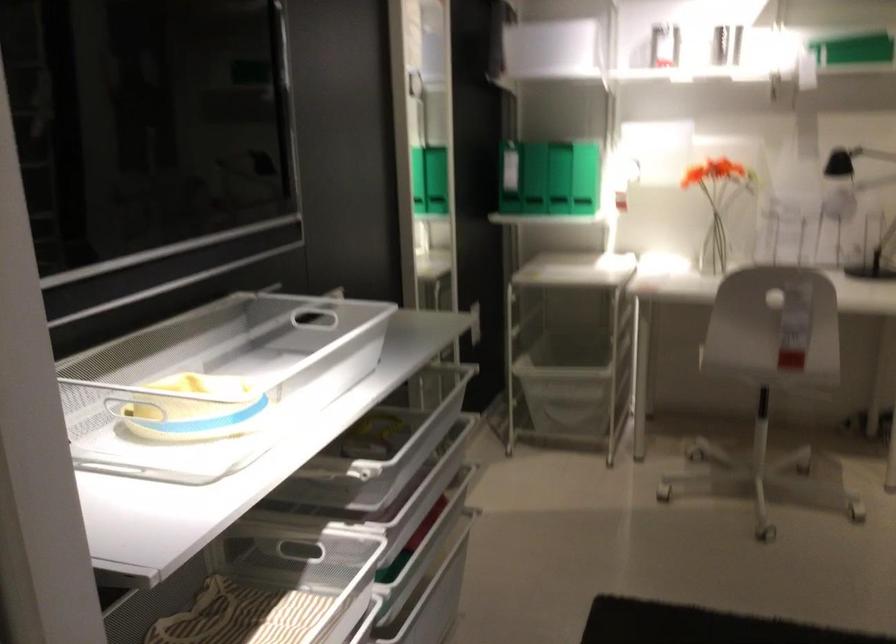
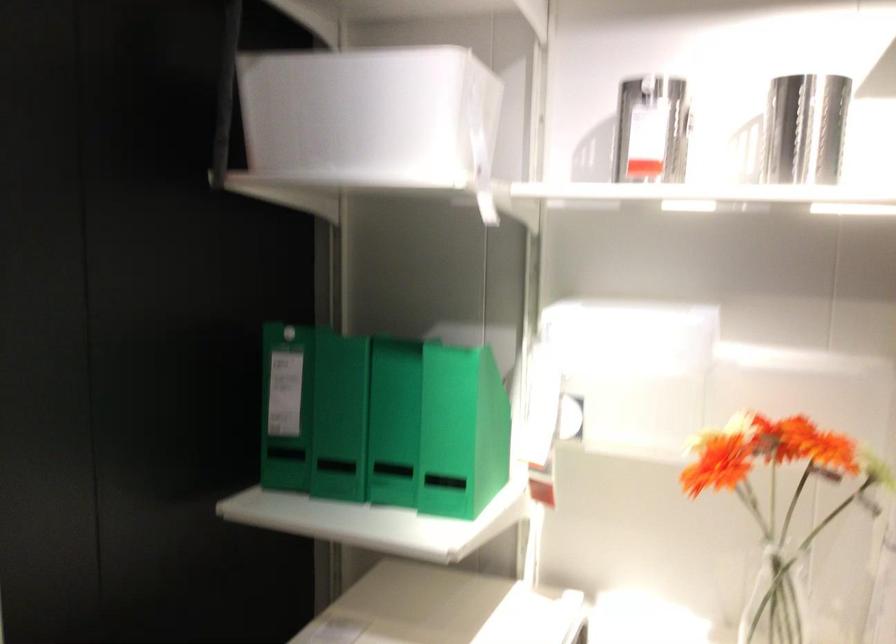
The point at (596,167) is marked in the first image. Where is the corresponding point in the second image?

(461, 431)